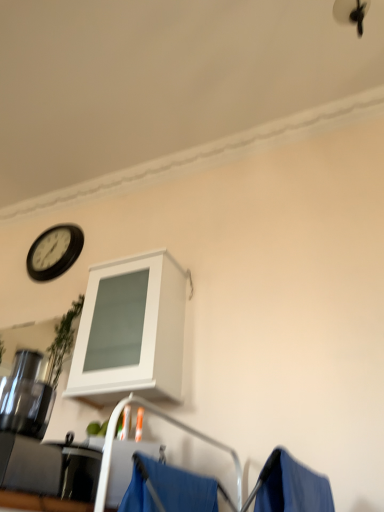
Question: Is black plastic clock at upper left with blue fabric at lower center?

Choices:
 (A) no
 (B) yes

Answer: (A)

Question: Is black plastic clock at upper left turned away from blue fabric at lower center?

Choices:
 (A) yes
 (B) no

Answer: (B)

Question: From a real-world perspective, does black plastic clock at upper left sit lower than blue fabric at lower center?

Choices:
 (A) yes
 (B) no

Answer: (B)

Question: Does black plastic clock at upper left turn towards blue fabric at lower center?

Choices:
 (A) no
 (B) yes

Answer: (A)

Question: From the image's perspective, is black plastic clock at upper left on top of blue fabric at lower center?

Choices:
 (A) no
 (B) yes

Answer: (B)

Question: Is black plastic clock at upper left taller than blue fabric at lower center?

Choices:
 (A) yes
 (B) no

Answer: (A)

Question: From a real-world perspective, is white matte cabinet at upper center on blue fabric at lower center?

Choices:
 (A) yes
 (B) no

Answer: (A)

Question: Can you confirm if white matte cabinet at upper center is smaller than blue fabric at lower center?

Choices:
 (A) yes
 (B) no

Answer: (B)

Question: Considering the relative sizes of white matte cabinet at upper center and blue fabric at lower center in the image provided, is white matte cabinet at upper center shorter than blue fabric at lower center?

Choices:
 (A) yes
 (B) no

Answer: (B)

Question: Considering the relative positions of white matte cabinet at upper center and blue fabric at lower center in the image provided, is white matte cabinet at upper center to the right of blue fabric at lower center from the viewer's perspective?

Choices:
 (A) yes
 (B) no

Answer: (B)

Question: Is white matte cabinet at upper center at the left side of blue fabric at lower center?

Choices:
 (A) yes
 (B) no

Answer: (A)

Question: Is white matte cabinet at upper center oriented towards blue fabric at lower center?

Choices:
 (A) yes
 (B) no

Answer: (B)

Question: Is blue fabric at lower center smaller than white matte cabinet at upper center?

Choices:
 (A) no
 (B) yes

Answer: (B)